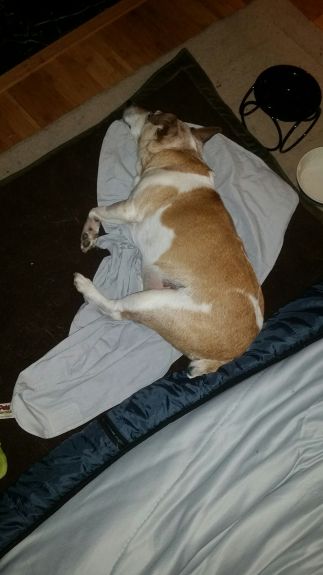
This screenshot has width=323, height=575. Identify the location of blanket. (260, 196).